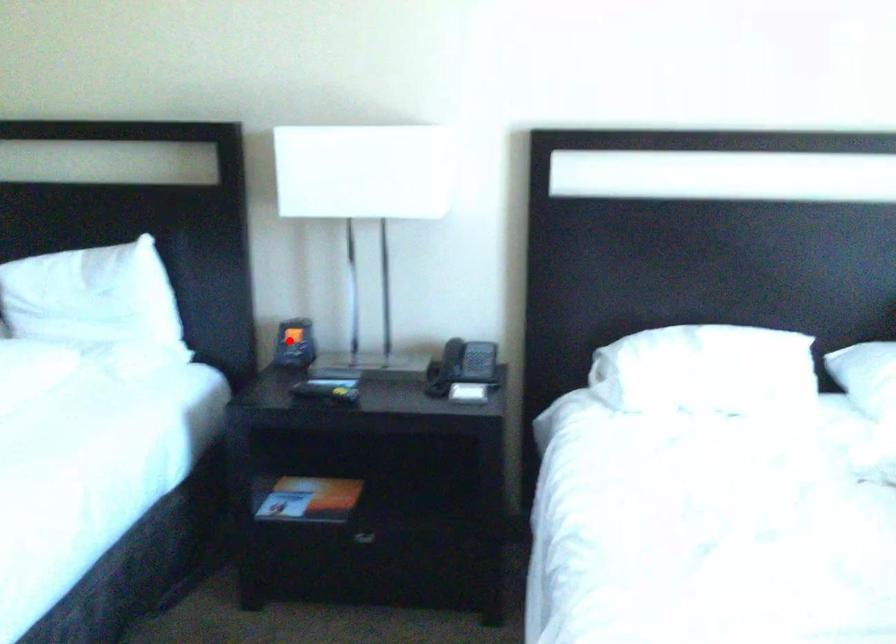
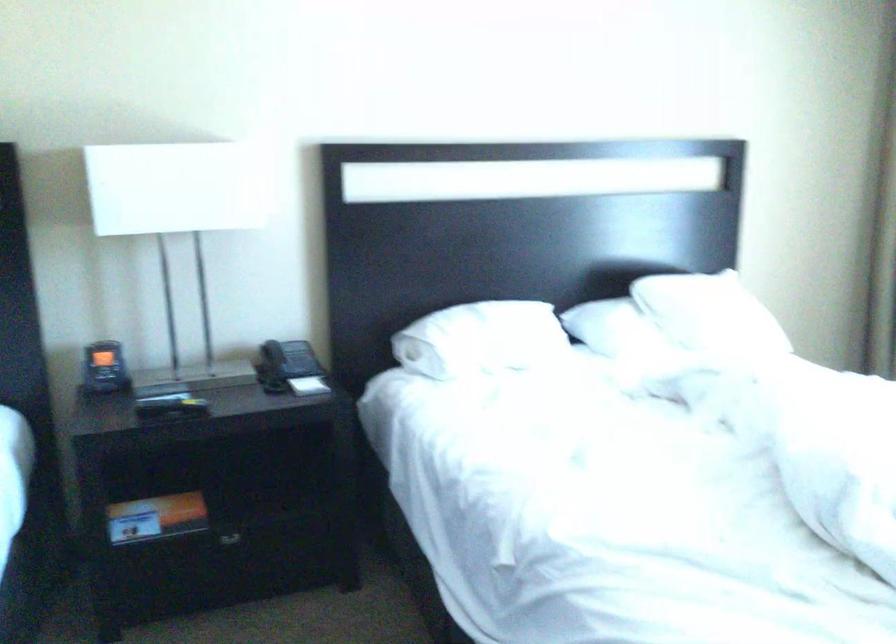
The point at the highlighted location is marked in the first image. Where is the corresponding point in the second image?

(104, 368)